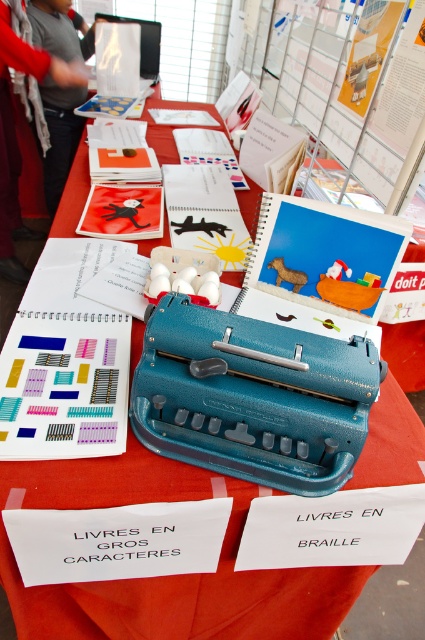
You are a visually impaired person trying to locate the teal plastic typewriter at center on the table. Based on the coordinates provided, can you determine if it is positioned closer to the left or right edge of the table?

The teal plastic typewriter at center is located at point (x=252, y=396), which means it is closer to the right edge of the table since the x coordinate 0.620 is greater than 0.5.

You are organizing a tactile materials workshop and need to place the gray fabric jacket at upper left and the gray sweater at upper left on a shelf. If the shelf has a width of 50 cm, can both items fit side by side?

The gray fabric jacket at upper left is wider than the gray sweater at upper left. However, without knowing their exact widths, it is impossible to determine if both will fit on a 50 cm shelf. More information is needed.